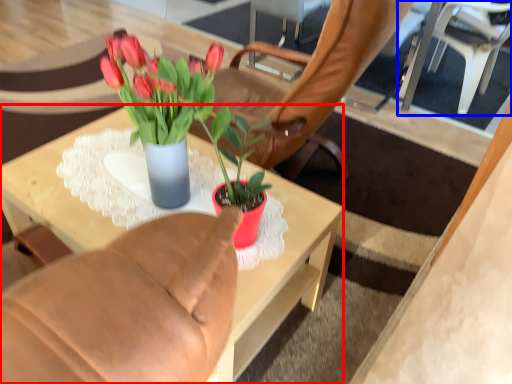
Question: Which of the following is the farthest to the observer, desk (highlighted by a red box) or chair (highlighted by a blue box)?

Choices:
 (A) desk
 (B) chair

Answer: (B)